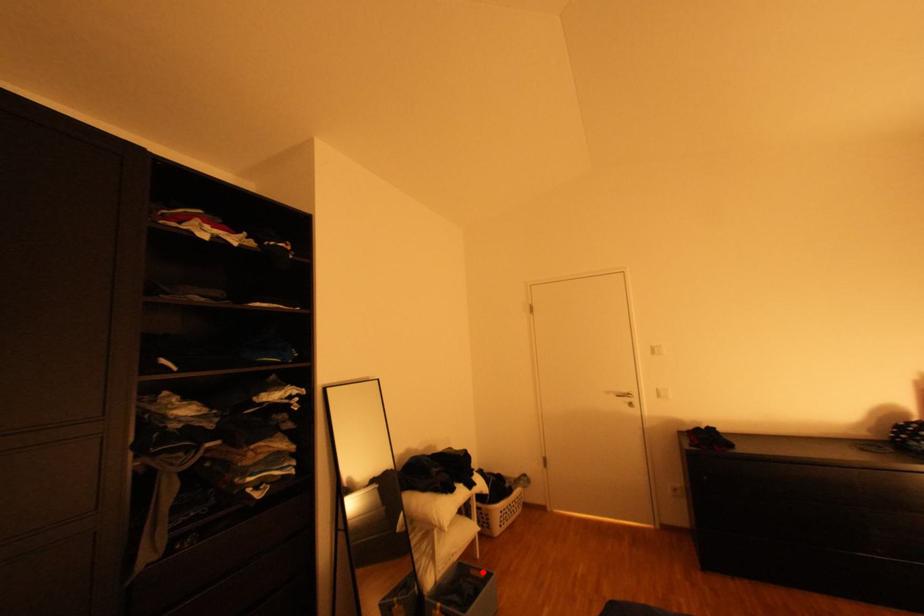
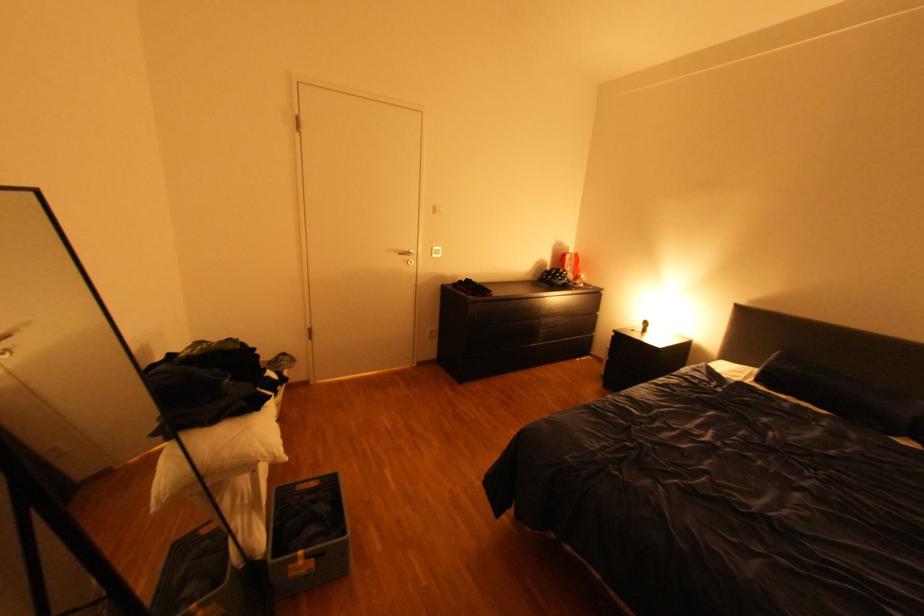
Question: I am providing you with two images of the same scene from different viewpoints. Given a red point in image1, look at the same physical point in image2. Is it:

Choices:
 (A) Closer to the viewpoint
 (B) Farther from the viewpoint

Answer: (B)